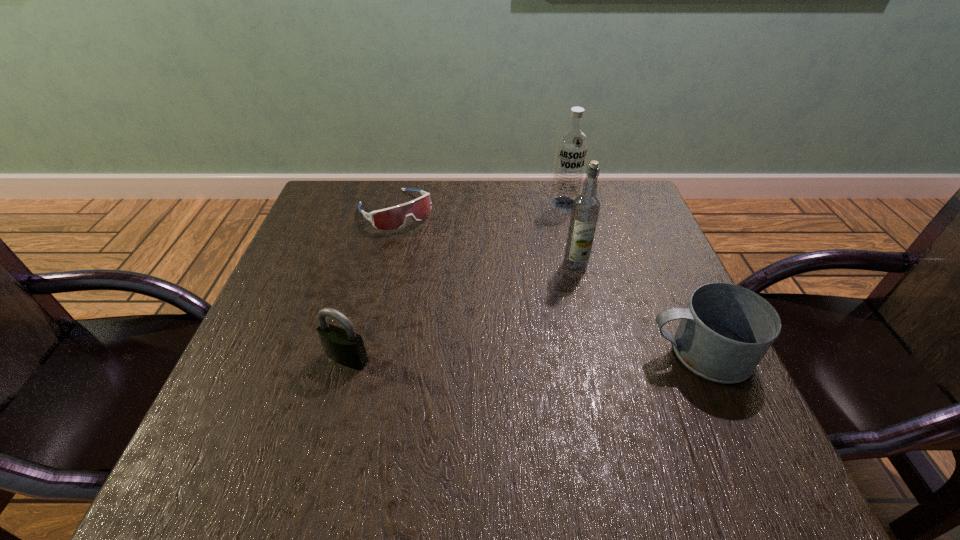
At what (x,y) coordinates should I click in order to perform the action: click on object located in the near edge section of the desktop. Please return your answer as a coordinate pair (x, y). Looking at the image, I should click on (725, 330).

The image size is (960, 540). Find the location of `padlock at the left edge`. padlock at the left edge is located at coordinates pos(344,346).

The width and height of the screenshot is (960, 540). I want to click on goggles located at the left edge, so click(395, 217).

Where is `object situated at the right edge`? The width and height of the screenshot is (960, 540). object situated at the right edge is located at coordinates (725, 330).

Identify the location of object that is at the far left corner. The width and height of the screenshot is (960, 540). click(395, 217).

Locate an element on the screen. The width and height of the screenshot is (960, 540). object that is at the near right corner is located at coordinates (725, 330).

At what (x,y) coordinates should I click in order to perform the action: click on free spot at the far edge of the desktop. Please return your answer as a coordinate pair (x, y). Looking at the image, I should click on (513, 184).

The image size is (960, 540). I want to click on free spot at the near edge of the desktop, so click(x=522, y=423).

At what (x,y) coordinates should I click in order to perform the action: click on vacant space at the left edge of the desktop. Please return your answer as a coordinate pair (x, y). The image size is (960, 540). Looking at the image, I should click on (319, 364).

Where is `vacant area at the right edge`? The width and height of the screenshot is (960, 540). vacant area at the right edge is located at coordinates (635, 319).